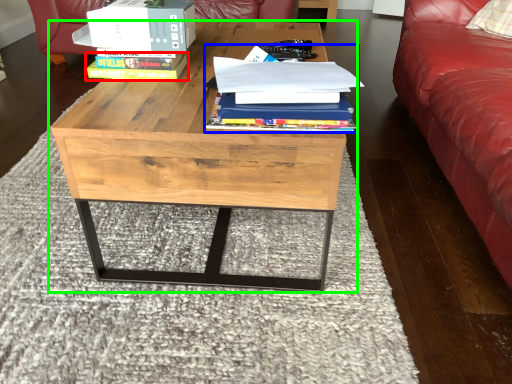
Question: Estimate the real-world distances between objects in this image. Which object is farther from paperback book (highlighted by a red box), book (highlighted by a blue box) or coffee table (highlighted by a green box)?

Choices:
 (A) book
 (B) coffee table

Answer: (A)